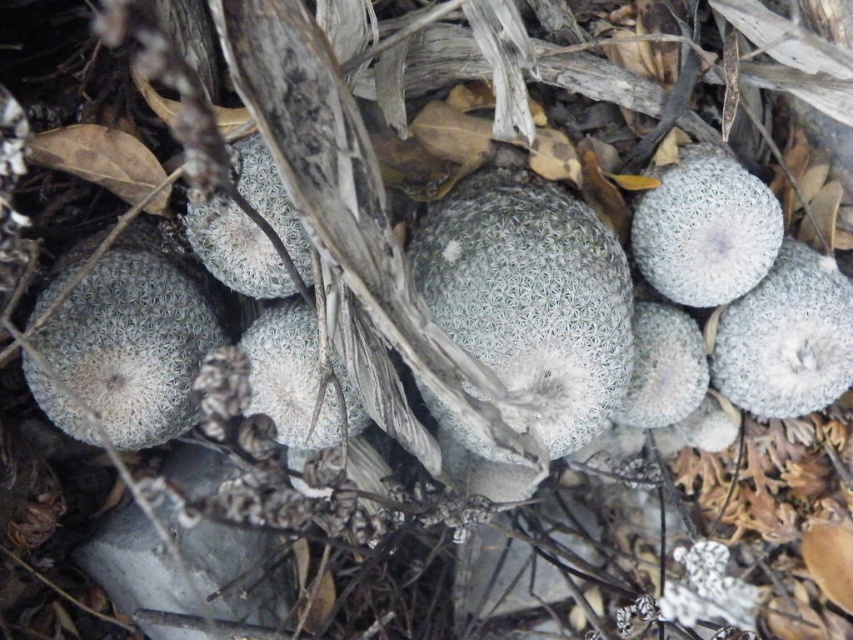
You are a desert explorer and you see the white fuzzy cactus at left and the gray fuzzy cactus at right. Which cactus is positioned more to the left side of the scene?

The white fuzzy cactus at left is positioned more to the left side of the scene than the gray fuzzy cactus at right.

You are a botanist studying the spatial distribution of plants in this desert scene. You need to locate the white fuzzy cactus at left. What are its coordinates?

The white fuzzy cactus at left is located at coordinates point (135, 340).

You are a gardener looking at the two white fuzzy cacti in the image. Which one is closer to you, the white fuzzy cactus at left or the white fuzzy cactus at upper right?

The white fuzzy cactus at left is closer to you because it is in front of the white fuzzy cactus at upper right.